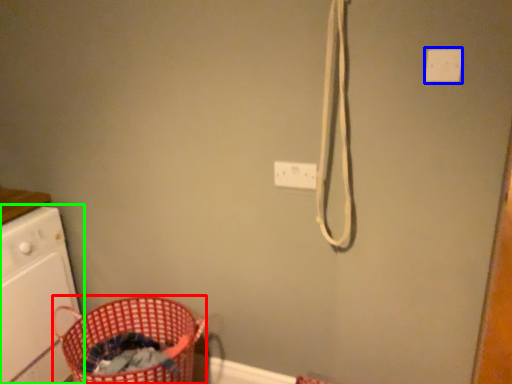
Question: Based on their relative distances, which object is farther from basket (highlighted by a red box)? Choose from light switch (highlighted by a blue box) and home appliance (highlighted by a green box).

Choices:
 (A) light switch
 (B) home appliance

Answer: (A)